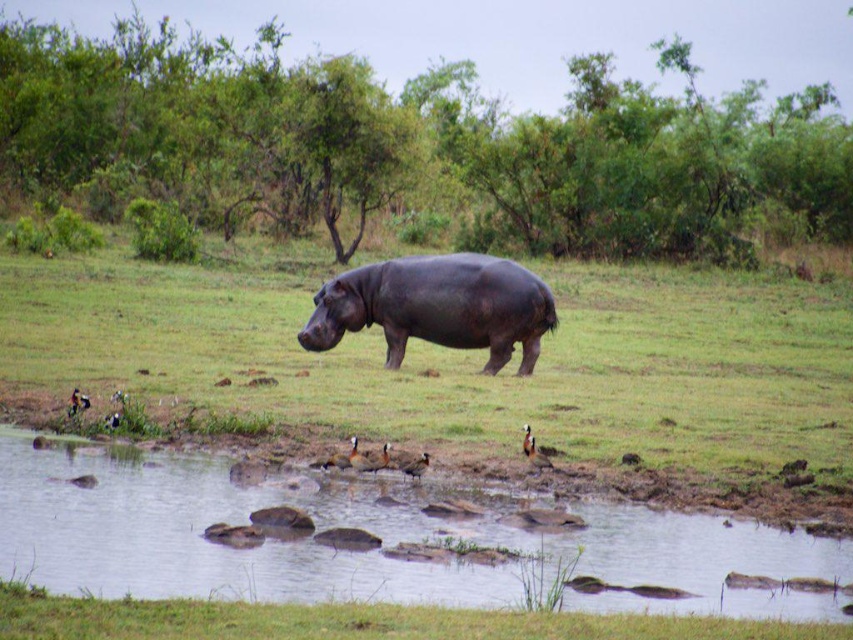
Question: Does clear water at pond center have a lesser width compared to green grassy at lower center?

Choices:
 (A) no
 (B) yes

Answer: (B)

Question: Can you confirm if dark green grass at center is positioned below green grassy at lower center?

Choices:
 (A) no
 (B) yes

Answer: (A)

Question: Can you confirm if dark green grass at center is bigger than green grassy at lower center?

Choices:
 (A) yes
 (B) no

Answer: (A)

Question: Among these points, which one is farthest from the camera?

Choices:
 (A) click(x=549, y=305)
 (B) click(x=621, y=532)
 (C) click(x=306, y=636)

Answer: (A)

Question: Based on their relative distances, which object is farther from the dark brown matte hippo at center?

Choices:
 (A) green grassy at lower center
 (B) dark green grass at center
 (C) clear water at pond center

Answer: (A)

Question: Which point is closer to the camera?

Choices:
 (A) (302, 506)
 (B) (715, 348)

Answer: (A)